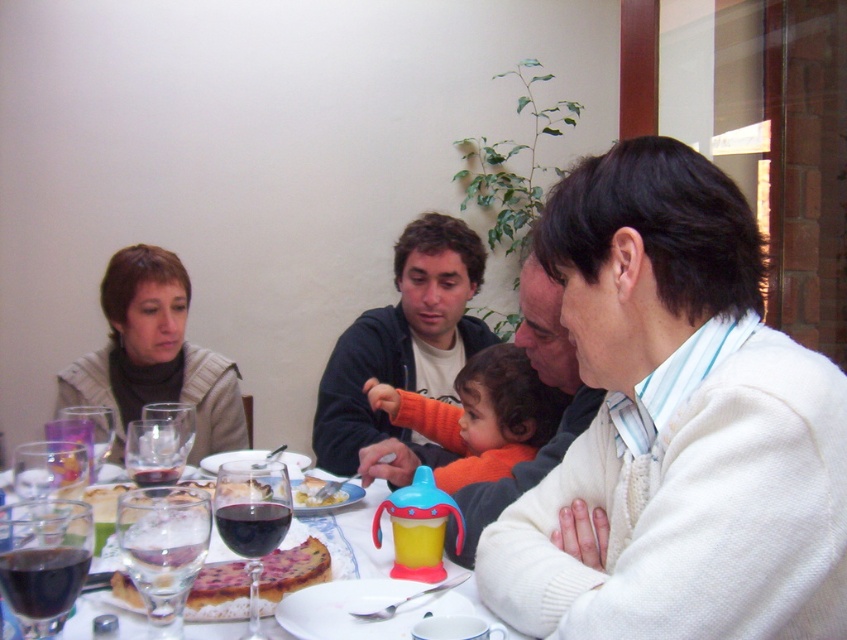
Question: Is transparent glass at lower left smaller than transparent glass at center?

Choices:
 (A) yes
 (B) no

Answer: (B)

Question: Does foamy glass at lower left appear under dark glass wine at lower left?

Choices:
 (A) yes
 (B) no

Answer: (B)

Question: Among these objects, which one is farthest from the camera?

Choices:
 (A) dark glass wine at lower left
 (B) transparent glass at center
 (C) transparent glass at left
 (D) golden crusty pizza at lower center

Answer: (C)

Question: Does translucent glass wine glass at lower left appear over translucent glass tableware at center?

Choices:
 (A) yes
 (B) no

Answer: (A)

Question: Which object appears closest to the camera in this image?

Choices:
 (A) transparent glass at center
 (B) knitted beige sweater at left
 (C) translucent glass tableware at center
 (D) dark red glass at center

Answer: (D)

Question: Which object is closer to the camera taking this photo?

Choices:
 (A) clear glass wine glass at table left
 (B) transparent glass at left
 (C) knitted beige sweater at left

Answer: (A)